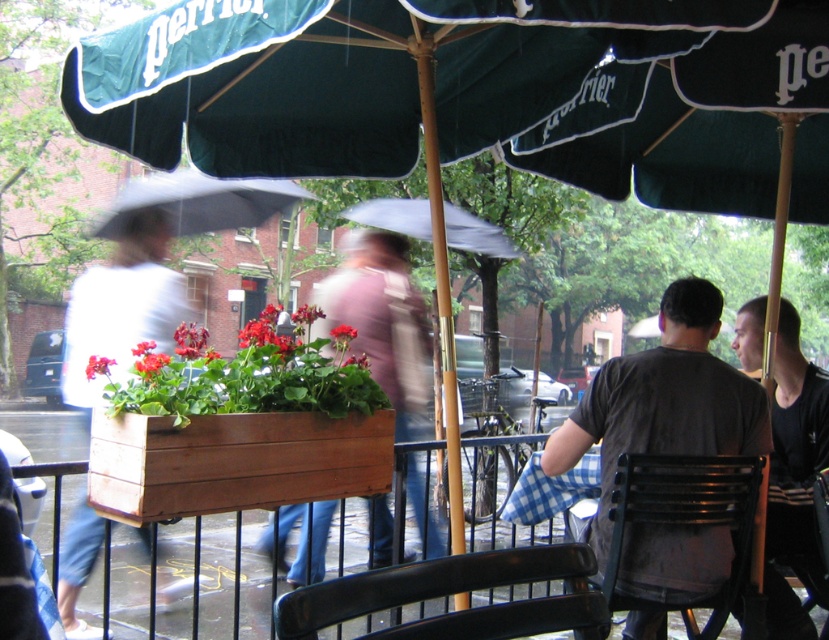
Which is below, wooden planter at center or black metal chair at lower right?

black metal chair at lower right is lower down.

Can you confirm if wooden planter at center is bigger than black metal chair at lower right?

Actually, wooden planter at center might be smaller than black metal chair at lower right.

Is point (388, 435) behind point (638, 497)?

Yes, point (388, 435) is farther from viewer.

The width and height of the screenshot is (829, 640). Find the location of `wooden planter at center`. wooden planter at center is located at coordinates (233, 461).

Can you confirm if white cotton shirt at left is thinner than black metal chair at lower right?

In fact, white cotton shirt at left might be wider than black metal chair at lower right.

Can you confirm if white cotton shirt at left is positioned below black metal chair at lower right?

Actually, white cotton shirt at left is above black metal chair at lower right.

Locate an element on the screen. white cotton shirt at left is located at coordinates (122, 307).

At what (x,y) coordinates should I click in order to perform the action: click on white cotton shirt at left. Please return your answer as a coordinate pair (x, y). Looking at the image, I should click on (122, 307).

Between dark gray shirt at right and black plastic chair at lower center, which one is positioned higher?

dark gray shirt at right

Is dark gray shirt at right shorter than black plastic chair at lower center?

No, dark gray shirt at right is not shorter than black plastic chair at lower center.

Who is more distant from viewer, (x=646, y=596) or (x=442, y=625)?

The point (x=646, y=596) is more distant.

Where is `dark gray shirt at right`? dark gray shirt at right is located at coordinates (663, 401).